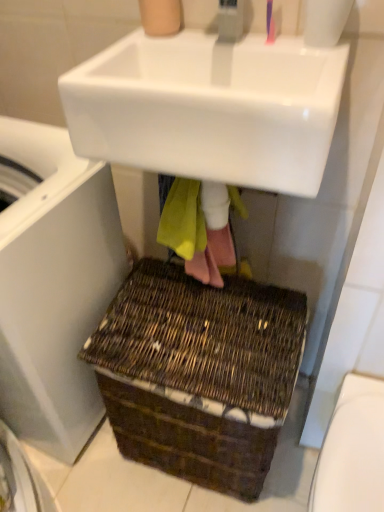
Question: From a real-world perspective, is white glossy toilet bowl at lower right located higher than white plastic washing machine at lower left?

Choices:
 (A) yes
 (B) no

Answer: (B)

Question: Are white glossy toilet bowl at lower right and white plastic washing machine at lower left making contact?

Choices:
 (A) yes
 (B) no

Answer: (B)

Question: Considering the relative positions of white glossy toilet bowl at lower right and white plastic washing machine at lower left in the image provided, is white glossy toilet bowl at lower right to the left of white plastic washing machine at lower left from the viewer's perspective?

Choices:
 (A) yes
 (B) no

Answer: (B)

Question: Is white glossy toilet bowl at lower right bigger than white plastic washing machine at lower left?

Choices:
 (A) yes
 (B) no

Answer: (B)

Question: Is white glossy toilet bowl at lower right outside of white plastic washing machine at lower left?

Choices:
 (A) no
 (B) yes

Answer: (B)

Question: In the image, is white glossy sink at upper center positioned in front of or behind white plastic washing machine at lower left?

Choices:
 (A) behind
 (B) front

Answer: (B)

Question: From a real-world perspective, is white glossy sink at upper center above or below white plastic washing machine at lower left?

Choices:
 (A) below
 (B) above

Answer: (B)

Question: In the image, is white glossy sink at upper center on the left side or the right side of white plastic washing machine at lower left?

Choices:
 (A) right
 (B) left

Answer: (A)

Question: Based on their sizes in the image, would you say white glossy sink at upper center is bigger or smaller than white plastic washing machine at lower left?

Choices:
 (A) small
 (B) big

Answer: (A)

Question: Looking at the image, does white plastic washing machine at lower left seem bigger or smaller compared to white glossy toilet bowl at lower right?

Choices:
 (A) small
 (B) big

Answer: (B)

Question: From their relative heights in the image, would you say white plastic washing machine at lower left is taller or shorter than white glossy toilet bowl at lower right?

Choices:
 (A) tall
 (B) short

Answer: (A)

Question: Considering the positions of point (16, 272) and point (370, 505), is point (16, 272) closer or farther from the camera than point (370, 505)?

Choices:
 (A) closer
 (B) farther

Answer: (B)

Question: Considering their positions, is white plastic washing machine at lower left located in front of or behind white glossy toilet bowl at lower right?

Choices:
 (A) behind
 (B) front

Answer: (B)

Question: Relative to white plastic washing machine at lower left, is pink plastic toothbrush at upper center in front or behind?

Choices:
 (A) front
 (B) behind

Answer: (B)

Question: From the image's perspective, is pink plastic toothbrush at upper center positioned above or below white plastic washing machine at lower left?

Choices:
 (A) above
 (B) below

Answer: (A)